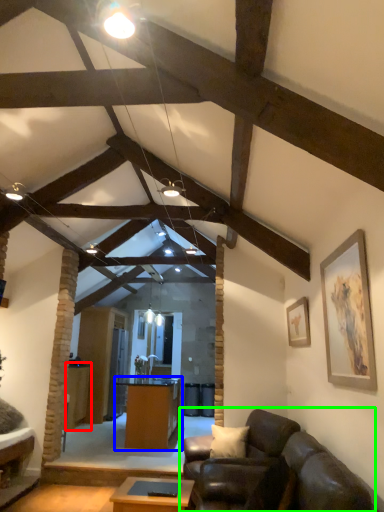
Question: Estimate the real-world distances between objects in this image. Which object is farther from table (highlighted by a red box), desk (highlighted by a blue box) or studio couch (highlighted by a green box)?

Choices:
 (A) desk
 (B) studio couch

Answer: (B)